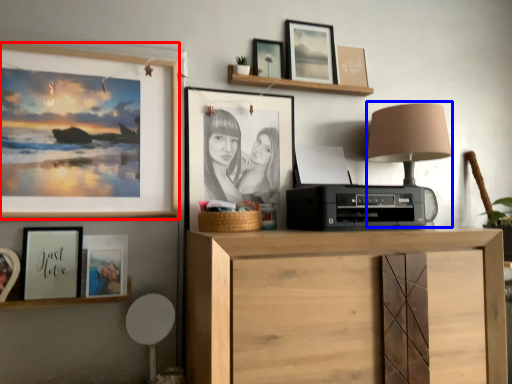
Question: Which point is further to the camera, picture frame (highlighted by a red box) or table lamp (highlighted by a blue box)?

Choices:
 (A) picture frame
 (B) table lamp

Answer: (B)